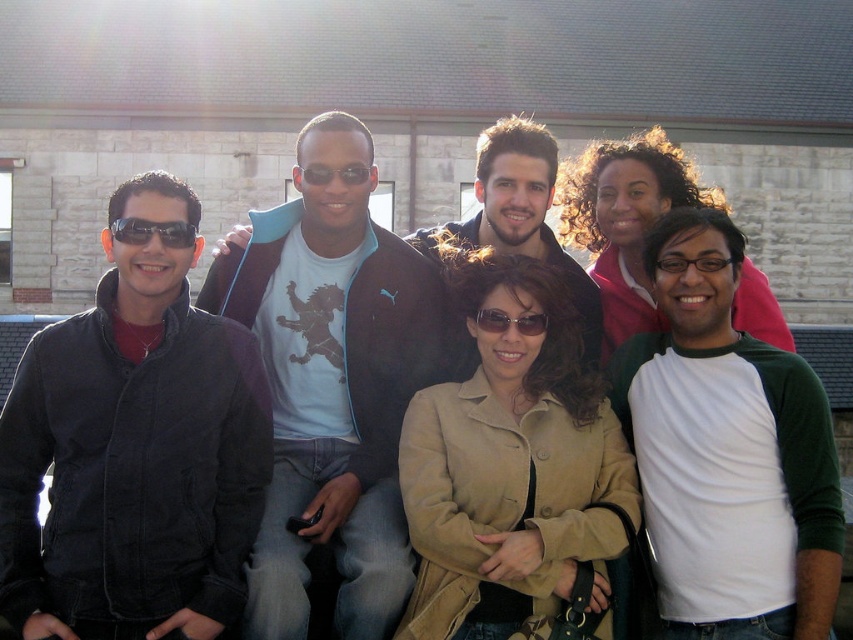
Based on the scene description, where is the tan suede jacket at center located in the image?

The tan suede jacket at center is located at point 0.723 in the x coordinate and 0.598 in the y coordinate.

You are a photographer trying to capture a closeup of the tan suede jacket at center and sunglasses at center. Given their sizes, which object should you zoom in on more to ensure both fit in the frame?

Since the tan suede jacket at center is wider than the sunglasses at center, you should zoom in more on the sunglasses at center to ensure both fit in the frame.